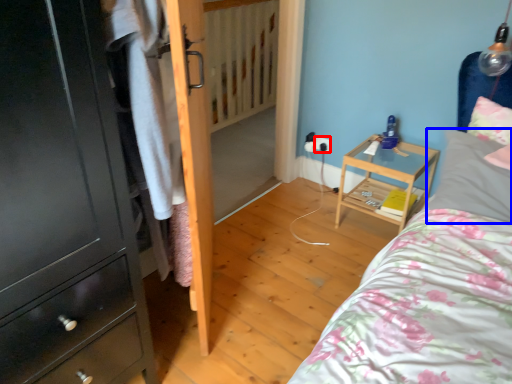
Question: Which object is further to the camera taking this photo, electric outlet (highlighted by a red box) or pillow (highlighted by a blue box)?

Choices:
 (A) electric outlet
 (B) pillow

Answer: (A)